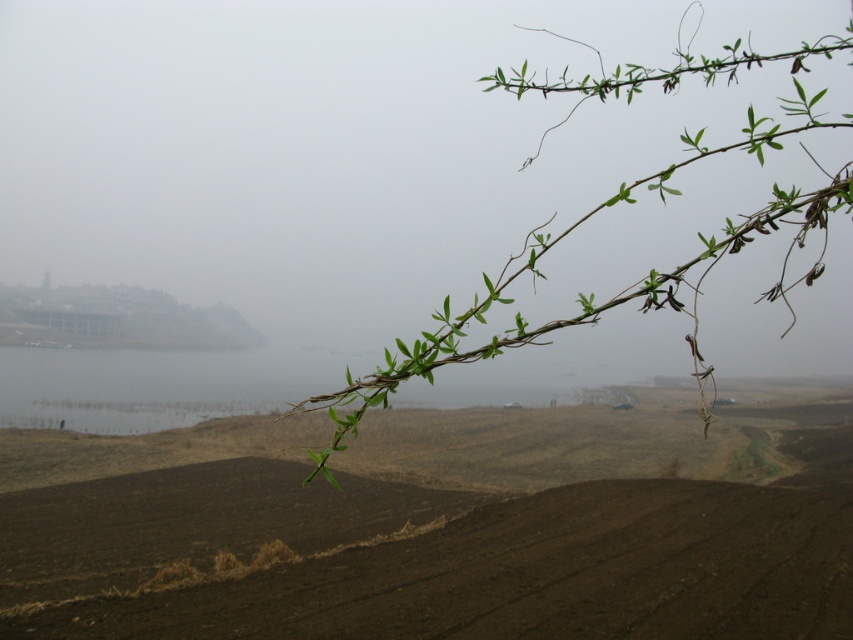
Between brown soil at center and green leafy branch at upper right, which one is positioned lower?

brown soil at center is below.

Between brown soil at center and green leafy branch at upper right, which one is positioned higher?

green leafy branch at upper right is higher up.

Where is `brown soil at center`? The width and height of the screenshot is (853, 640). brown soil at center is located at coordinates (438, 528).

This screenshot has width=853, height=640. I want to click on brown soil at center, so click(438, 528).